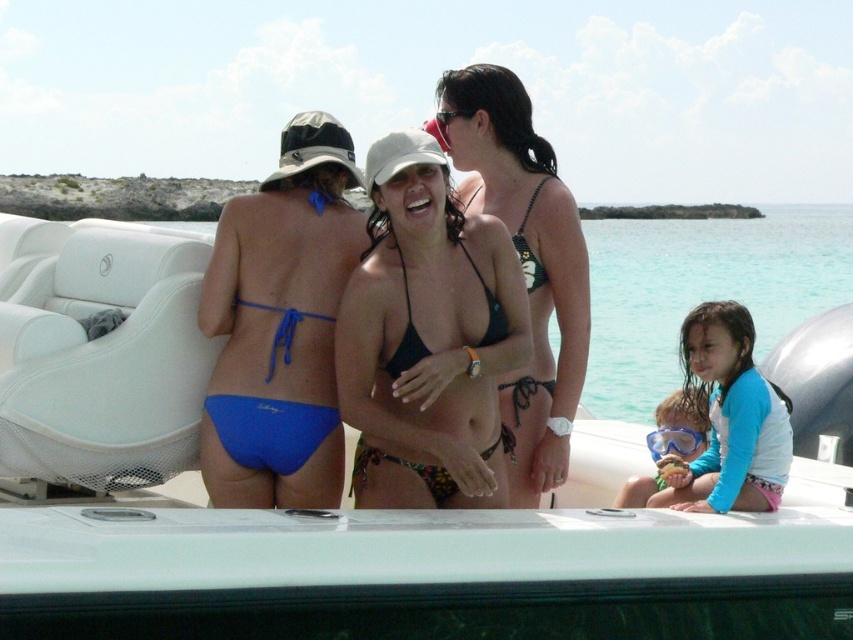
Which is behind, point (589, 522) or point (700, 404)?

Positioned behind is point (700, 404).

The height and width of the screenshot is (640, 853). Describe the element at coordinates (440, 566) in the screenshot. I see `white matte boat at center` at that location.

This screenshot has width=853, height=640. Identify the location of white matte boat at center. (440, 566).

Find the location of a particular element. white matte boat at center is located at coordinates (440, 566).

Can you confirm if blue fabric bikini bottom at left is shorter than black matte bikini at center?

Incorrect, blue fabric bikini bottom at left's height does not fall short of black matte bikini at center's.

Between blue fabric bikini bottom at left and black matte bikini at center, which one is positioned lower?

black matte bikini at center is lower down.

Is point (241, 358) farther from camera compared to point (395, 348)?

No, (241, 358) is closer to viewer.

The height and width of the screenshot is (640, 853). I want to click on blue fabric bikini bottom at left, so click(280, 324).

Is the position of blue rubber snorkel mask at lower center more distant than that of transparent plastic goggles at lower right?

No, blue rubber snorkel mask at lower center is in front of transparent plastic goggles at lower right.

Does blue rubber snorkel mask at lower center appear on the left side of transparent plastic goggles at lower right?

No, blue rubber snorkel mask at lower center is not to the left of transparent plastic goggles at lower right.

The image size is (853, 640). What do you see at coordinates (680, 426) in the screenshot?
I see `blue rubber snorkel mask at lower center` at bounding box center [680, 426].

Find the location of a particular element. blue rubber snorkel mask at lower center is located at coordinates (680, 426).